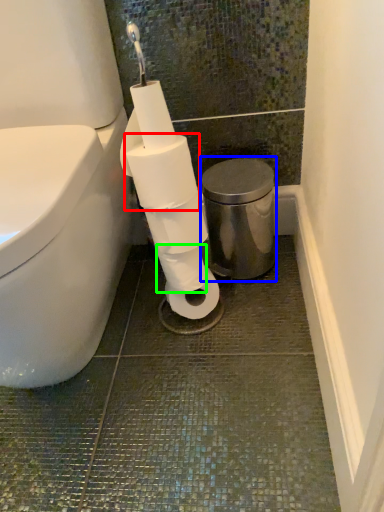
Question: Which object is the farthest from toilet paper (highlighted by a red box)? Choose among these: bidet (highlighted by a blue box) or toilet paper (highlighted by a green box).

Choices:
 (A) bidet
 (B) toilet paper

Answer: (A)